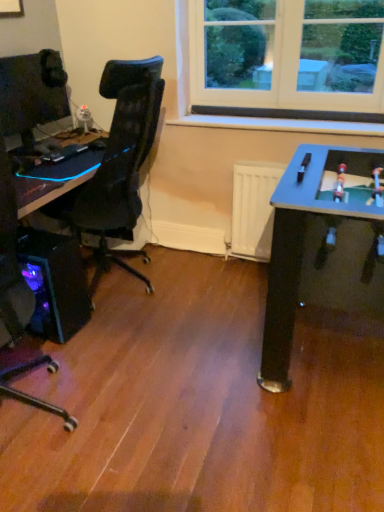
Find the location of a particular element. free point to the right of translucent purple plastic computer tower at lower left is located at coordinates (109, 329).